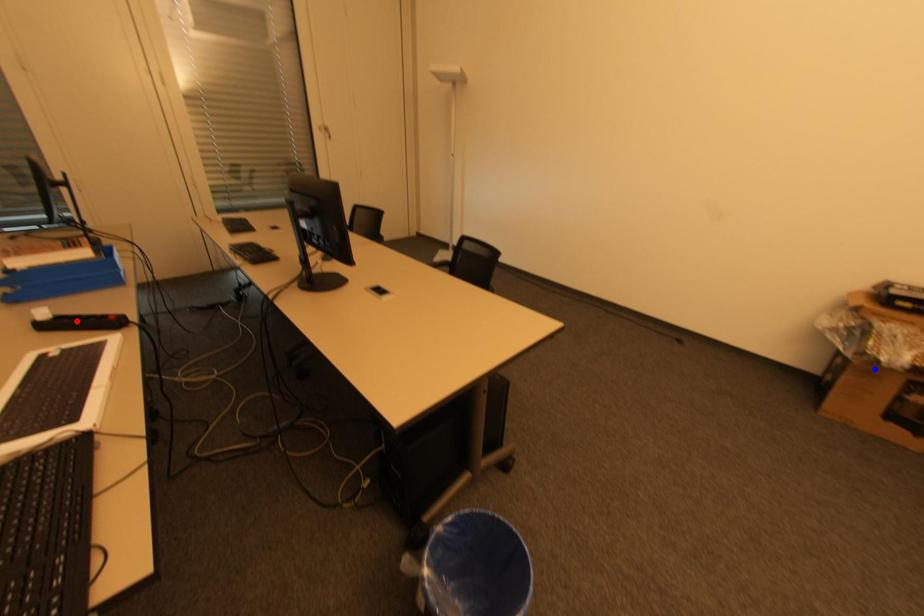
Question: Which of the two points in the image is closer to the camera?

Choices:
 (A) Blue point is closer.
 (B) Red point is closer.

Answer: (B)